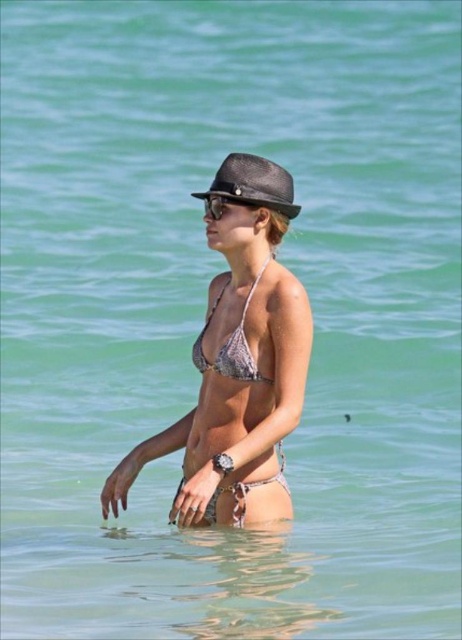
Question: Can you confirm if metallic silver bikini at center is positioned to the right of black matte sunglasses at center?

Choices:
 (A) no
 (B) yes

Answer: (A)

Question: Which object appears closest to the camera in this image?

Choices:
 (A) black straw fedora at center
 (B) black matte sunglasses at center
 (C) metallic silver bikini at center

Answer: (C)

Question: Among these points, which one is nearest to the camera?

Choices:
 (A) (238, 193)
 (B) (210, 314)
 (C) (207, 460)

Answer: (C)

Question: Can you confirm if printed fabric bikini at center is positioned to the right of black matte sunglasses at center?

Choices:
 (A) yes
 (B) no

Answer: (A)

Question: Can you confirm if printed fabric bikini at center is positioned to the right of printed fabric bikini top at center?

Choices:
 (A) yes
 (B) no

Answer: (A)

Question: Among these objects, which one is farthest from the camera?

Choices:
 (A) black matte sunglasses at center
 (B) black straw fedora at center
 (C) printed fabric bikini at center
 (D) metallic silver bikini at center

Answer: (A)